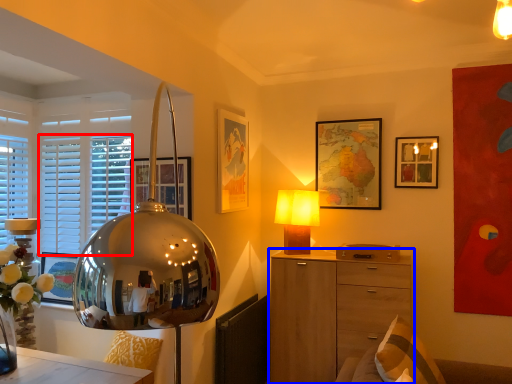
Question: Which point is closer to the camera, blind (highlighted by a red box) or chest of drawers (highlighted by a blue box)?

Choices:
 (A) blind
 (B) chest of drawers

Answer: (B)